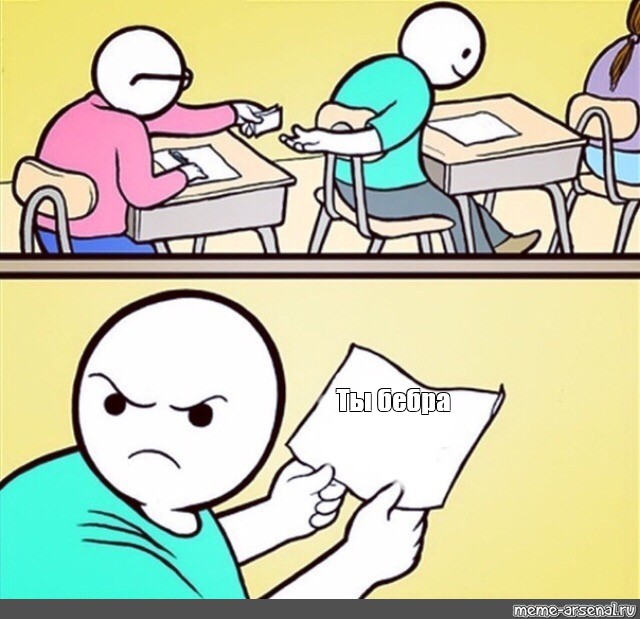
The height and width of the screenshot is (619, 640). I want to click on blank paper on desk towards the right in the top image, so click(484, 121).